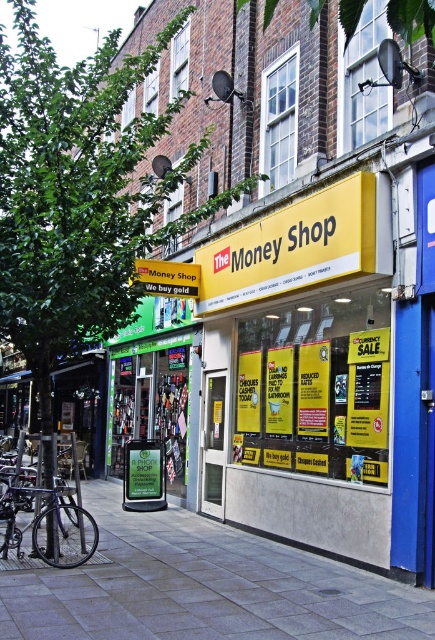
You are a delivery person who needs to place a package between the green leafy tree at upper left and the yellow matte sign at center. The package requires 10 feet of space. Is there enough space between them?

The green leafy tree at upper left and yellow matte sign at center are 8.68 feet apart, so there is not enough space to place the package requiring 10 feet between them.

You are a delivery person trying to place a small box on the gray concrete pavement at lower center. However, there is a yellow matte sign at center nearby. Which surface is narrower in width?

The gray concrete pavement at lower center is thinner than the yellow matte sign at center, so the gray concrete pavement at lower center is narrower in width.

You are standing on the sidewalk looking at the storefront. Which object, the green leafy tree at upper left or the yellow matte sign at center, would appear larger in your field of view?

The green leafy tree at upper left is closer to the viewer than the yellow matte sign at center, so it would appear larger in your field of view.